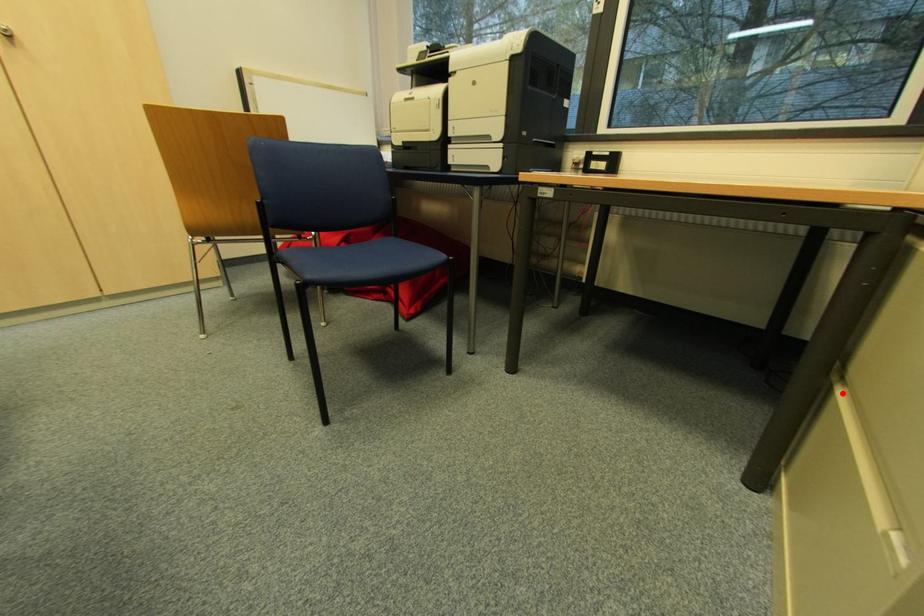
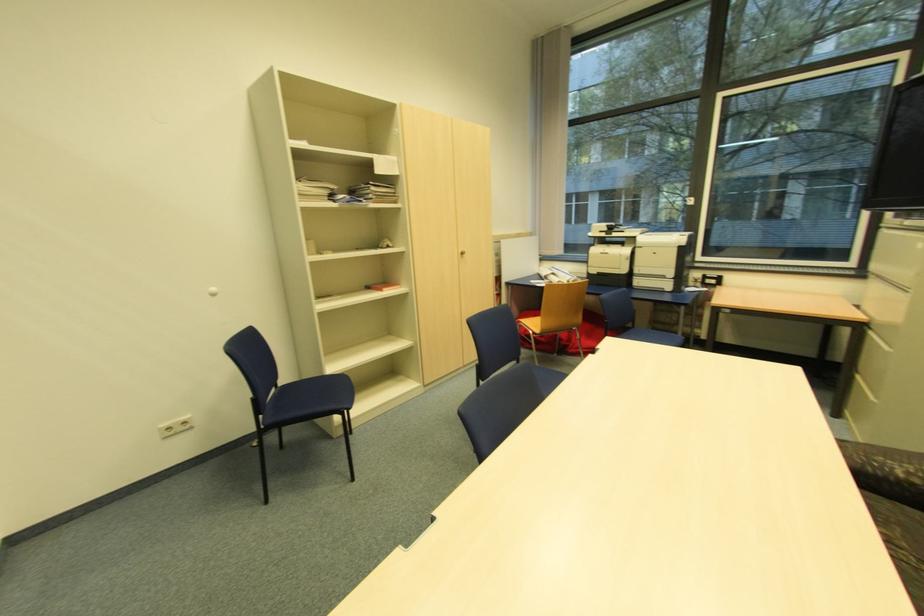
Question: I am providing you with two images of the same scene from different viewpoints. In image1, a red point is highlighted. Considering the same 3D point in image2, which of the following is correct?

Choices:
 (A) It is closer
 (B) It is farther

Answer: (B)